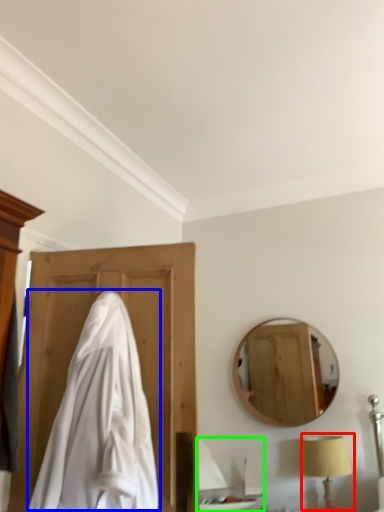
Question: Estimate the real-world distances between objects in this image. Which object is closer to table lamp (highlighted by a red box), cloak (highlighted by a blue box) or sink (highlighted by a green box)?

Choices:
 (A) cloak
 (B) sink

Answer: (B)